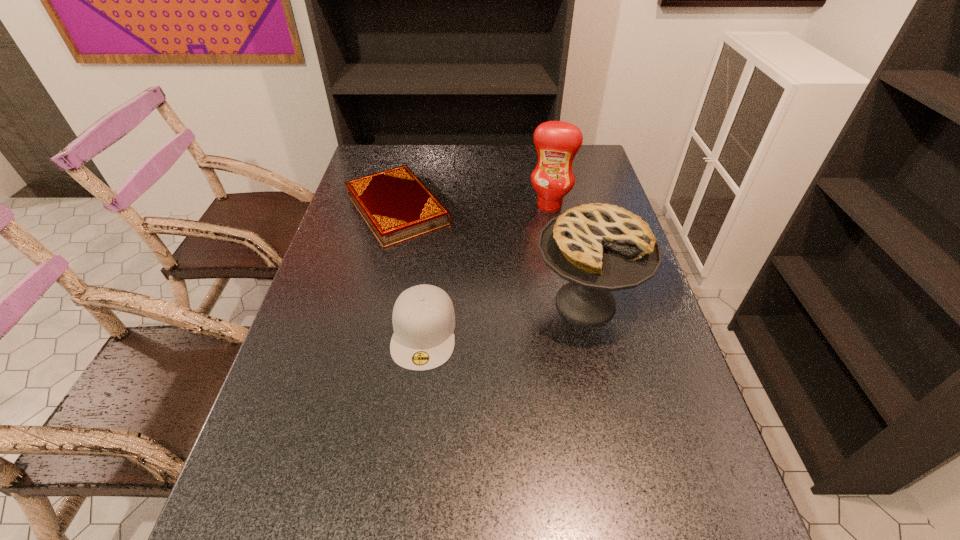
Locate an element on the screen. This screenshot has height=540, width=960. vacant space that satisfies the following two spatial constraints: 1. on the back side of the hardback book; 2. on the left side of the condiment is located at coordinates (397, 205).

Image resolution: width=960 pixels, height=540 pixels. Find the location of `vacant point that satisfies the following two spatial constraints: 1. on the back side of the condiment; 2. on the left side of the hardback book`. vacant point that satisfies the following two spatial constraints: 1. on the back side of the condiment; 2. on the left side of the hardback book is located at coordinates (397, 205).